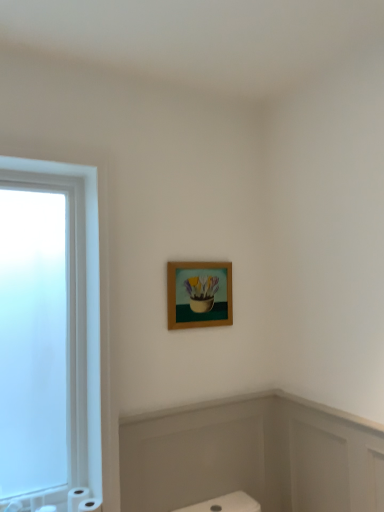
Question: In terms of width, does wooden frame at upper center look wider or thinner when compared to white matte toilet paper at lower left, positioned as the first toilet paper in right-to-left order?

Choices:
 (A) thin
 (B) wide

Answer: (A)

Question: Is wooden frame at upper center bigger or smaller than white matte toilet paper at lower left, which is counted as the third toilet paper, starting from the left?

Choices:
 (A) small
 (B) big

Answer: (B)

Question: Which is nearer to the white matte toilet paper at lower left, the second toilet paper from the left?

Choices:
 (A) wooden frame at upper center
 (B) white matte toilet paper at lower left, positioned as the first toilet paper in right-to-left order
 (C) white matte bath at lower center
 (D) white matte toilet paper at lower left, the 3th toilet paper viewed from the right

Answer: (B)

Question: Which is nearer to the wooden frame at upper center?

Choices:
 (A) white matte toilet paper at lower left, which is counted as the third toilet paper, starting from the left
 (B) white matte toilet paper at lower left, placed as the second toilet paper when sorted from right to left
 (C) white matte bath at lower center
 (D) white matte toilet paper at lower left, which ranks as the 1th toilet paper in left-to-right order

Answer: (C)